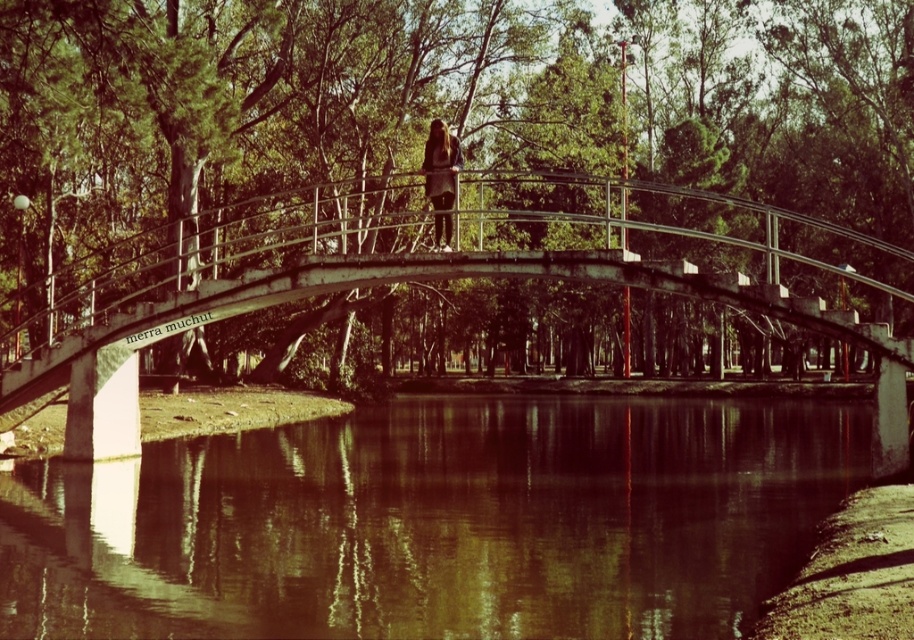
You are a photographer wanting to capture the matte black dress at center and the concrete bridge at center in a single shot. Can you ensure that both objects are fully visible in the frame without any part of them being cut off?

The concrete bridge at center is positioned under matte black dress at center, so both objects can be captured in the same frame without any parts being cut off as they are aligned vertically.